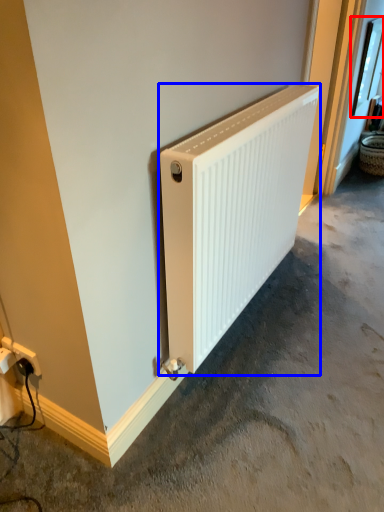
Question: Which object appears farthest to the camera in this image, window (highlighted by a red box) or radiator (highlighted by a blue box)?

Choices:
 (A) window
 (B) radiator

Answer: (A)